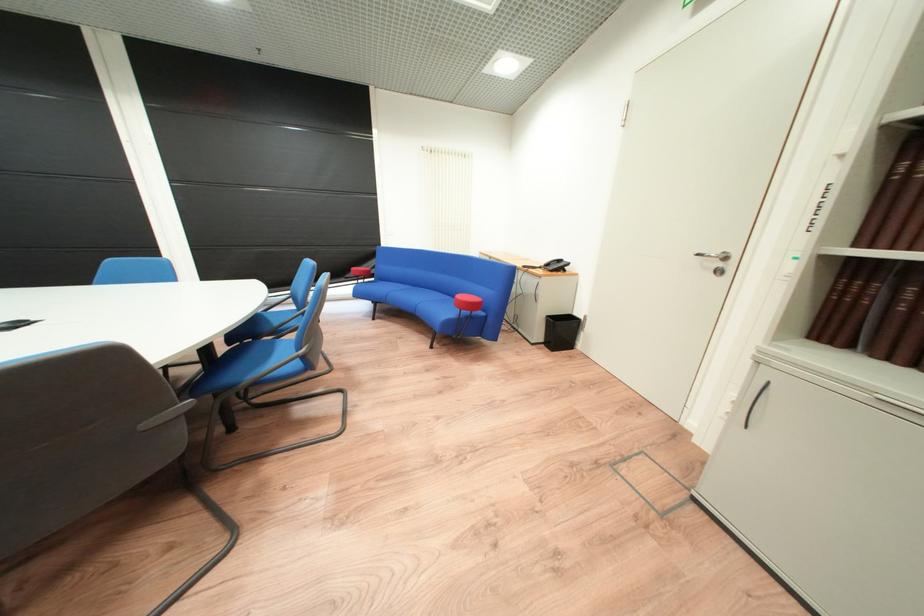
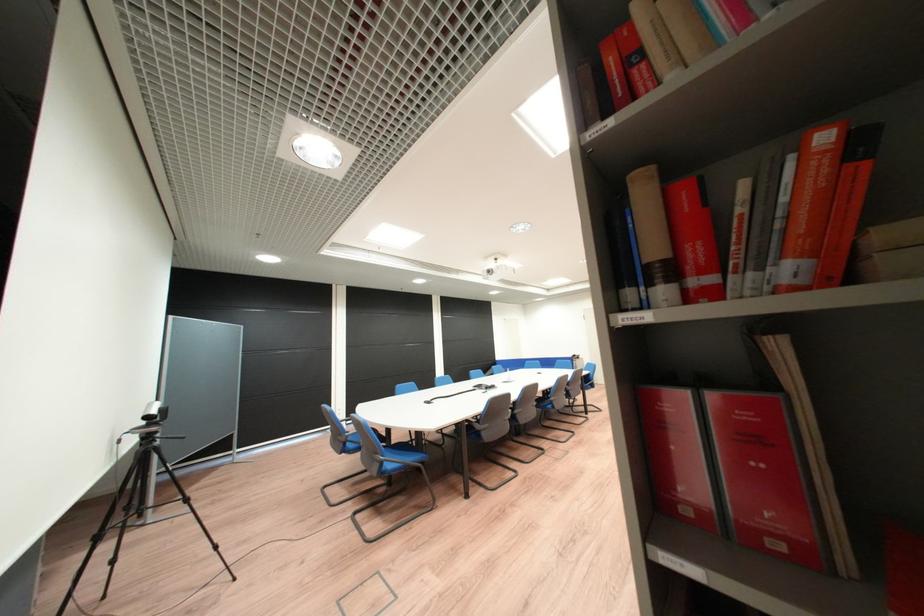
Question: I am providing you with two images of the same scene from different viewpoints. Which of the following objects are not visible in image2?

Choices:
 (A) small grey camera
 (B) black telephone
 (C) carton of eggs
 (D) red book

Answer: (B)